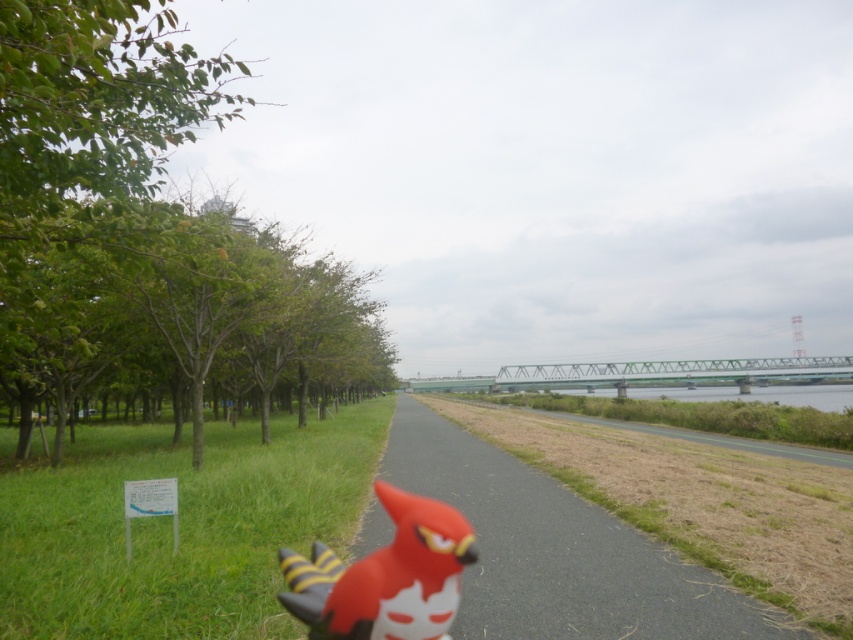
You are a photographer standing at the end of the pathway. You want to take a photo that includes both the green leafy trees at left and the rubber duck at center. Which object should you focus on first to ensure both are in sharp focus?

You should focus on the green leafy trees at left first because the rubber duck at center is behind them, so focusing on the closer object ensures both are in focus.